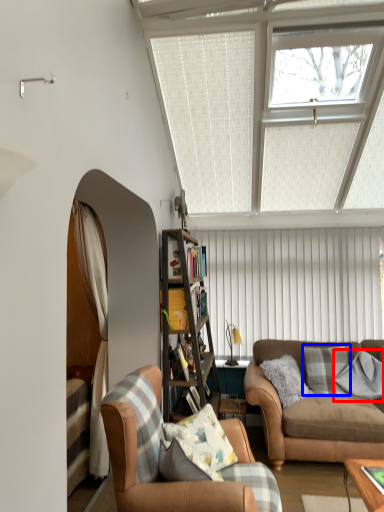
Question: Among these objects, which one is nearest to the camera, pillow (highlighted by a red box) or pillow (highlighted by a blue box)?

Choices:
 (A) pillow
 (B) pillow

Answer: (A)